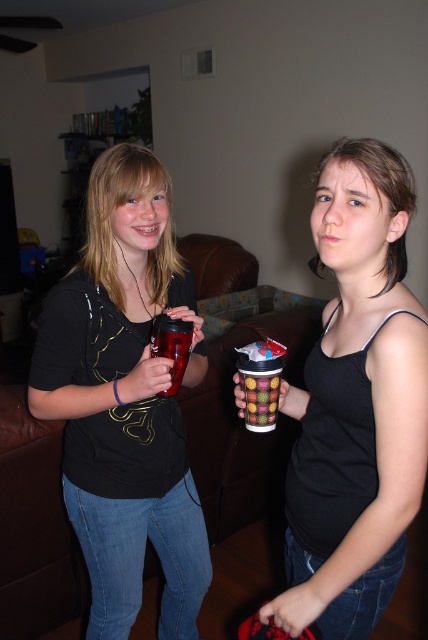
You are designing a storage box that needs to accommodate both the matte black tank top at center and the multicolored plastic cup at center. Based on their sizes, which object requires more horizontal space in the box?

The matte black tank top at center requires more horizontal space in the box because its width is larger than the multicolored plastic cup at center.

What are the coordinates of the matte plastic cup at center?

The matte plastic cup at center is located at point (124, 400).

You are a photographer setting up a shot of the two people in the living room. You want to ensure that the matte plastic cup at center and the matte black tank top at center are both visible in the frame. Based on their positions, which object should you focus on first to make sure both are in the frame?

The matte plastic cup at center is below the matte black tank top at center. To ensure both are visible, focus on the matte black tank top at center first, as it is higher up, allowing the cup to naturally fall into the frame below it.